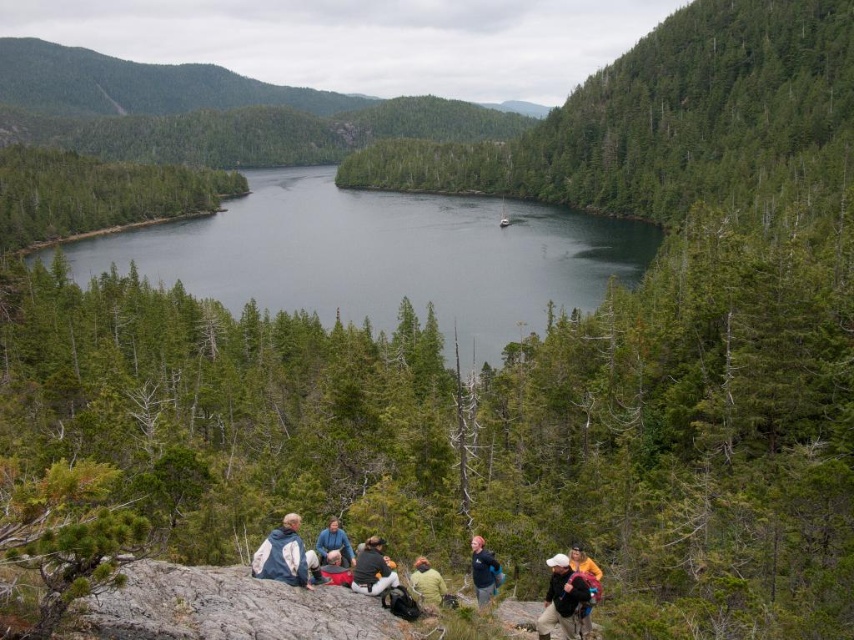
Which of these two, blue fabric jacket at center or green fuzzy jacket at lower center, stands taller?

Standing taller between the two is blue fabric jacket at center.

Is point (334, 536) behind point (439, 582)?

Yes.

This screenshot has width=854, height=640. I want to click on blue fabric jacket at center, so click(x=332, y=545).

Can you confirm if green fuzzy jacket at lower center is positioned below red fabric bag at center?

Yes, green fuzzy jacket at lower center is below red fabric bag at center.

Can you confirm if green fuzzy jacket at lower center is thinner than red fabric bag at center?

Correct, green fuzzy jacket at lower center's width is less than red fabric bag at center's.

Which is behind, point (436, 586) or point (326, 579)?

Positioned behind is point (436, 586).

At what (x,y) coordinates should I click in order to perform the action: click on green fuzzy jacket at lower center. Please return your answer as a coordinate pair (x, y). Looking at the image, I should click on (427, 582).

Who is more distant from viewer, (284, 516) or (496, 563)?

Point (496, 563)

What do you see at coordinates (284, 554) in the screenshot? I see `white fleece jacket at lower center` at bounding box center [284, 554].

Image resolution: width=854 pixels, height=640 pixels. Find the location of `white fleece jacket at lower center`. white fleece jacket at lower center is located at coordinates (284, 554).